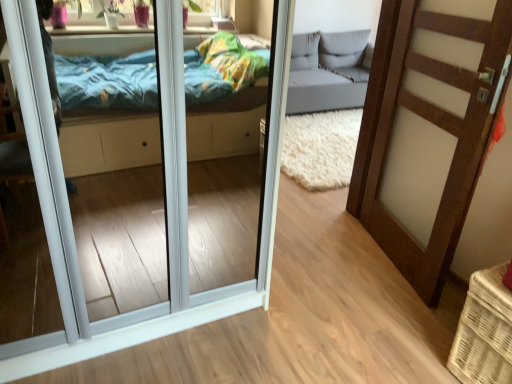
Where is `vacant space in front of brown wood door at right, placed as the 1th door when sorted from right to left`? vacant space in front of brown wood door at right, placed as the 1th door when sorted from right to left is located at coordinates (381, 312).